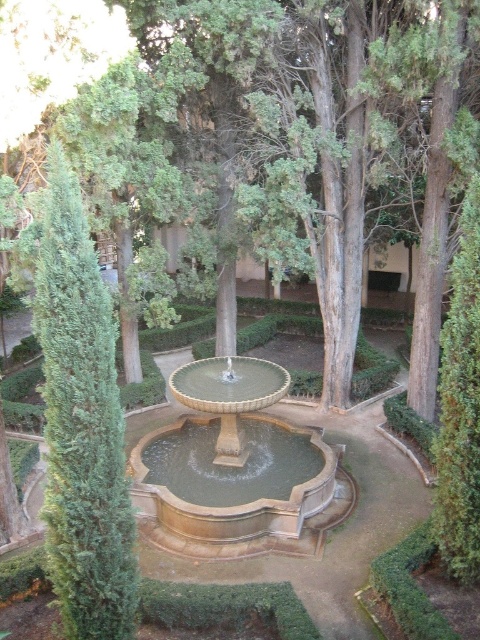
Question: Can you confirm if green leafy tree at center is positioned below green textured bush at left?

Choices:
 (A) no
 (B) yes

Answer: (A)

Question: Among these objects, which one is farthest from the camera?

Choices:
 (A) green leafy tree at center
 (B) green textured bush at left

Answer: (A)

Question: Which point appears farthest from the camera in this image?

Choices:
 (A) (287, 456)
 (B) (60, 480)
 (C) (468, 36)

Answer: (A)

Question: Which point is farther from the camera taking this photo?

Choices:
 (A) (52, 380)
 (B) (145, 49)
 (C) (190, 433)

Answer: (B)

Question: Is green leafy tree at center closer to the viewer compared to green textured bush at left?

Choices:
 (A) yes
 (B) no

Answer: (B)

Question: Does green textured bush at left have a smaller size compared to stone fountain at center?

Choices:
 (A) no
 (B) yes

Answer: (B)